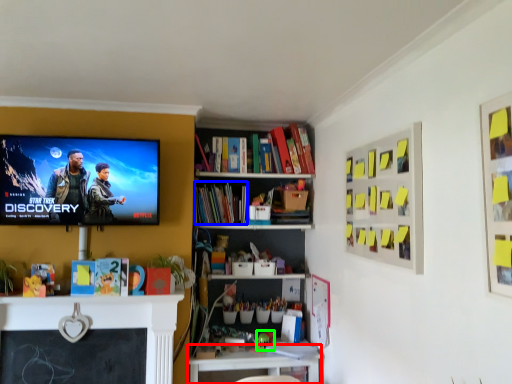
Question: Which object is the closest to the table (highlighted by a red box)? Choose among these: book (highlighted by a blue box) or toy (highlighted by a green box).

Choices:
 (A) book
 (B) toy

Answer: (B)